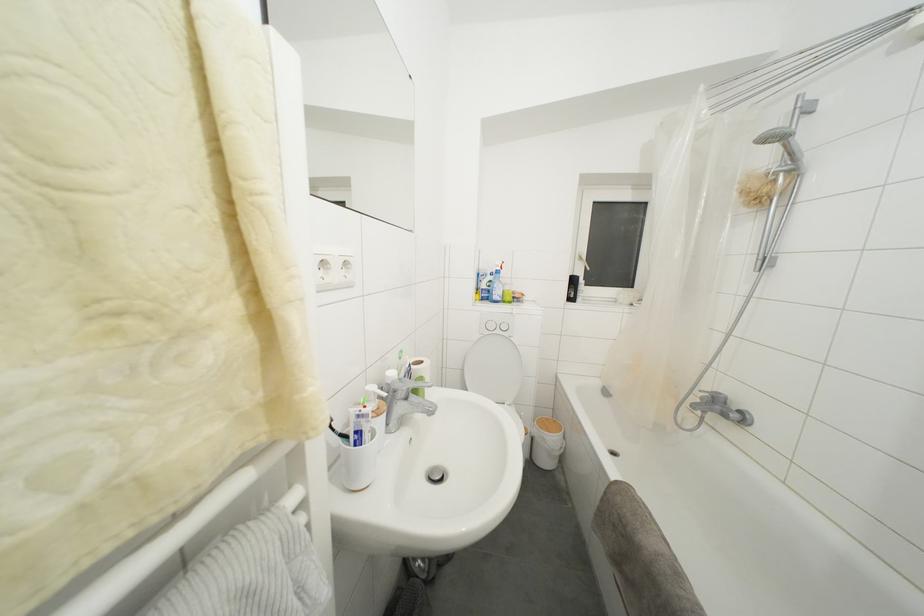
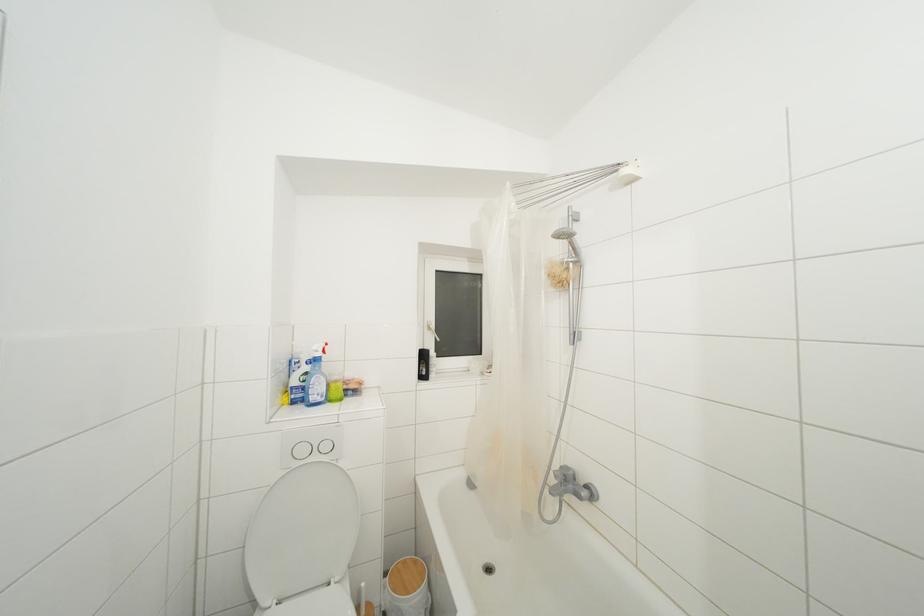
In the second image, find the point that corresponds to pixel 779 185 in the first image.

(572, 273)